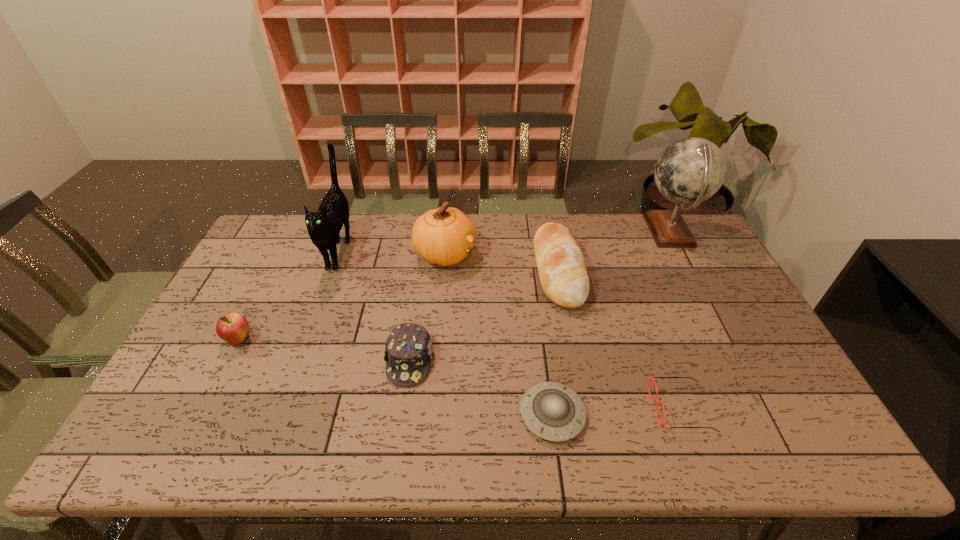
You are a GUI agent. You are given a task and a screenshot of the screen. Output one action in this format:
    pyautogui.click(x=<x>, y=<y>)
    Task: Click on the rightmost object
    The height and width of the screenshot is (540, 960).
    Given the screenshot: What is the action you would take?
    pyautogui.click(x=691, y=170)

This screenshot has height=540, width=960. In order to click on cat in this screenshot , I will do `click(324, 226)`.

You are a GUI agent. You are given a task and a screenshot of the screen. Output one action in this format:
    pyautogui.click(x=<x>, y=<y>)
    Task: Click on the sixth shortest object
    
    Given the screenshot: What is the action you would take?
    pyautogui.click(x=444, y=236)

Identify the location of bread. This screenshot has width=960, height=540. (563, 275).

At what (x,y) coordinates should I click in order to perform the action: click on apple. Please return your answer as a coordinate pair (x, y). The height and width of the screenshot is (540, 960). Looking at the image, I should click on (232, 327).

Find the location of a particular element. the third shortest object is located at coordinates pyautogui.click(x=408, y=349).

Where is `the seventh tallest object`? Image resolution: width=960 pixels, height=540 pixels. the seventh tallest object is located at coordinates click(x=650, y=378).

What are the coordinates of `the seventh object from left to right` in the screenshot? It's located at (650, 378).

Where is `saucer`? This screenshot has width=960, height=540. saucer is located at coordinates (552, 411).

The width and height of the screenshot is (960, 540). I want to click on free space located 0.250m at the equator of the rightmost object, so click(570, 232).